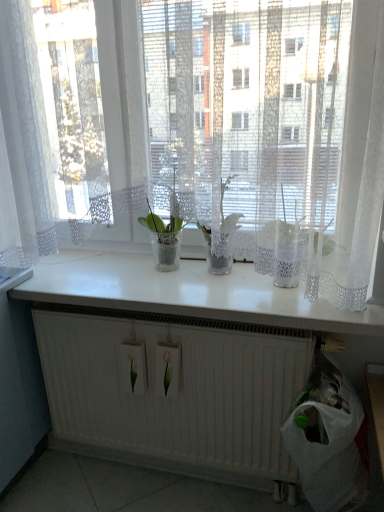
Question: Considering the relative positions of white glossy counter top at center and white matte radiator at lower center in the image provided, is white glossy counter top at center behind white matte radiator at lower center?

Choices:
 (A) yes
 (B) no

Answer: (B)

Question: Does white glossy counter top at center have a lesser height compared to white matte radiator at lower center?

Choices:
 (A) yes
 (B) no

Answer: (A)

Question: Considering the relative positions of white glossy counter top at center and white matte radiator at lower center in the image provided, is white glossy counter top at center to the left of white matte radiator at lower center from the viewer's perspective?

Choices:
 (A) yes
 (B) no

Answer: (A)

Question: Is white glossy counter top at center facing away from white matte radiator at lower center?

Choices:
 (A) yes
 (B) no

Answer: (B)

Question: From the image's perspective, does white glossy counter top at center appear lower than white matte radiator at lower center?

Choices:
 (A) yes
 (B) no

Answer: (B)

Question: Do you think translucent glass vase at center is within white plastic bag at lower right, or outside of it?

Choices:
 (A) outside
 (B) inside

Answer: (A)

Question: Considering the positions of translucent glass vase at center and white plastic bag at lower right in the image, is translucent glass vase at center taller or shorter than white plastic bag at lower right?

Choices:
 (A) tall
 (B) short

Answer: (B)

Question: Is point (142, 223) positioned closer to the camera than point (327, 415)?

Choices:
 (A) farther
 (B) closer

Answer: (A)

Question: From the image's perspective, relative to white plastic bag at lower right, is translucent glass vase at center above or below?

Choices:
 (A) above
 (B) below

Answer: (A)

Question: From the image's perspective, is white lace curtain at upper center above or below white plastic bag at lower right?

Choices:
 (A) above
 (B) below

Answer: (A)

Question: Is white lace curtain at upper center bigger or smaller than white plastic bag at lower right?

Choices:
 (A) big
 (B) small

Answer: (A)

Question: Is white lace curtain at upper center to the left or to the right of white plastic bag at lower right in the image?

Choices:
 (A) right
 (B) left

Answer: (B)

Question: Is white lace curtain at upper center wider or thinner than white plastic bag at lower right?

Choices:
 (A) wide
 (B) thin

Answer: (B)

Question: Is white glossy counter top at center to the left or to the right of white matte radiator at lower center in the image?

Choices:
 (A) right
 (B) left

Answer: (B)

Question: Considering the positions of white glossy counter top at center and white matte radiator at lower center in the image, is white glossy counter top at center wider or thinner than white matte radiator at lower center?

Choices:
 (A) thin
 (B) wide

Answer: (B)